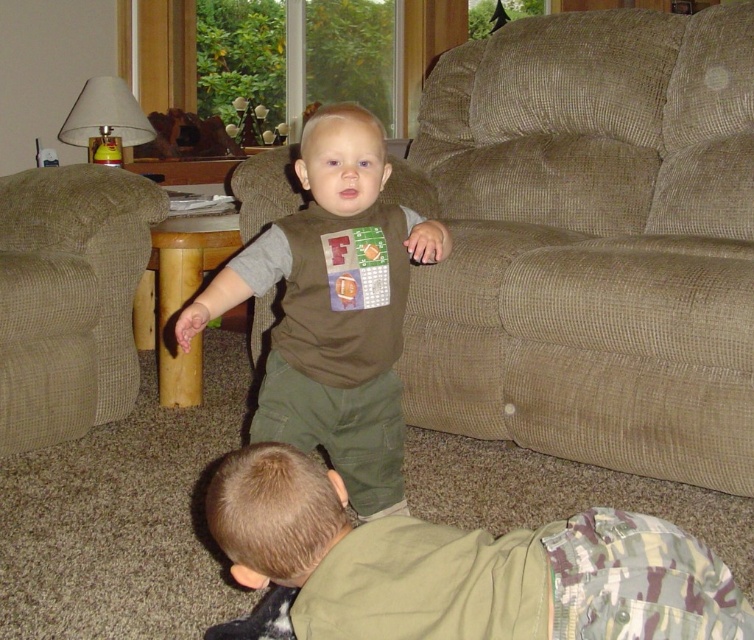
You are a parent trying to locate your child wearing camouflage pants at lower center in the living room. According to the coordinates provided, where exactly would you find them?

The camouflage pants at lower center are located at the 2D coordinates point (461,566).

You are a photographer trying to capture a photo of both children in the living room. You notice two specific points in the scene marked as point 1 at coordinates (x=372, y=362) and point 2 at coordinates (x=127, y=205). Which point is closer to your camera lens?

Point 1 at coordinates (x=372, y=362) is closer to the camera lens than point 2 at coordinates (x=127, y=205).